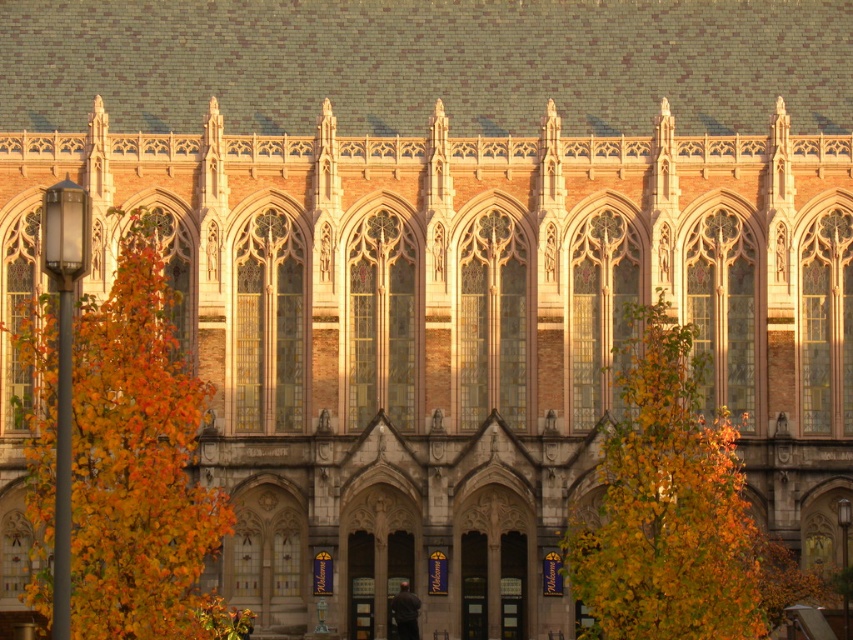
Question: Which point is closer to the camera taking this photo?

Choices:
 (A) (134, 540)
 (B) (619, 444)

Answer: (A)

Question: Can you confirm if orange leafy tree at left is positioned below yellow-green leaves at center?

Choices:
 (A) no
 (B) yes

Answer: (A)

Question: Which point is farther to the camera?

Choices:
 (A) click(x=711, y=589)
 (B) click(x=88, y=320)

Answer: (B)

Question: Does orange leafy tree at left have a lesser width compared to yellow-green leaves at center?

Choices:
 (A) no
 (B) yes

Answer: (A)

Question: Can you confirm if orange leafy tree at left is bigger than yellow-green leaves at center?

Choices:
 (A) no
 (B) yes

Answer: (B)

Question: Which object is farther from the camera taking this photo?

Choices:
 (A) yellow-green leaves at center
 (B) orange leafy tree at left

Answer: (A)